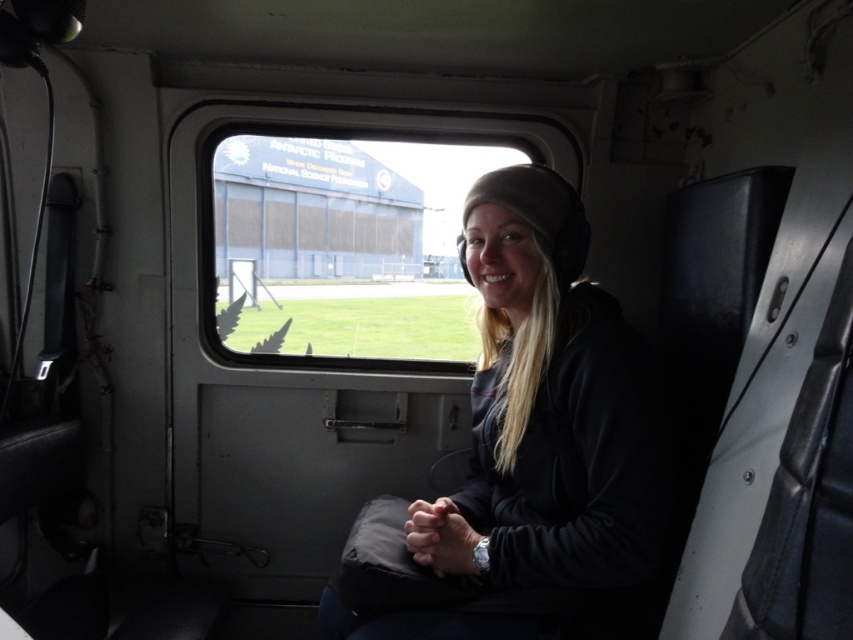
Question: Can you confirm if black fleece jacket at center is positioned to the right of clear glass window at center?

Choices:
 (A) no
 (B) yes

Answer: (B)

Question: Which point is closer to the camera?

Choices:
 (A) black fleece jacket at center
 (B) clear glass window at center

Answer: (A)

Question: Can you confirm if black fleece jacket at center is positioned to the left of clear glass window at center?

Choices:
 (A) no
 (B) yes

Answer: (A)

Question: Is black fleece jacket at center positioned at the back of clear glass window at center?

Choices:
 (A) no
 (B) yes

Answer: (A)